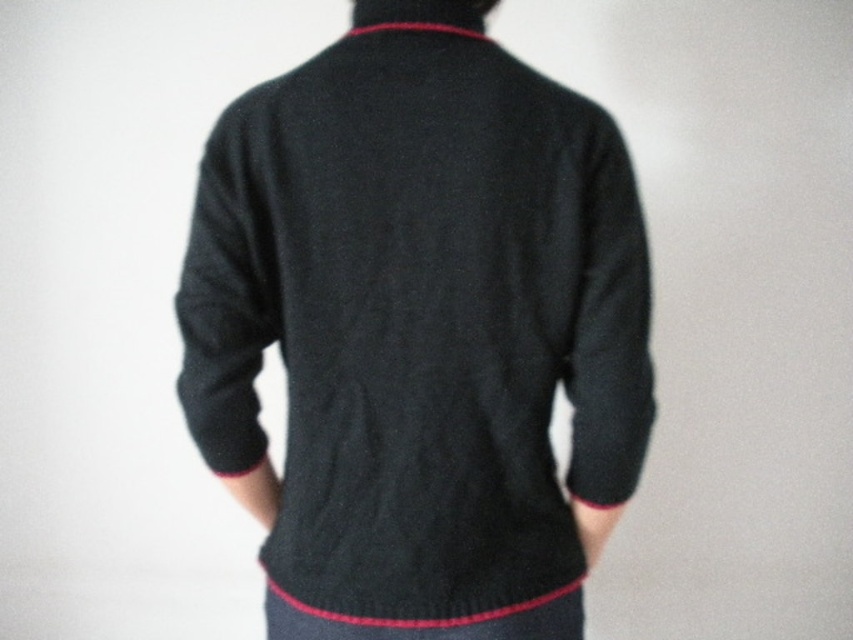
Question: Is dark gray wool sweater at center further to the viewer compared to red knitted neckband at center?

Choices:
 (A) yes
 (B) no

Answer: (A)

Question: Is dark gray wool sweater at center below red knitted neckband at center?

Choices:
 (A) no
 (B) yes

Answer: (B)

Question: Is dark gray wool sweater at center to the left of red knitted neckband at center from the viewer's perspective?

Choices:
 (A) yes
 (B) no

Answer: (A)

Question: Among these objects, which one is farthest from the camera?

Choices:
 (A) dark gray wool sweater at center
 (B) red knitted neckband at center

Answer: (A)